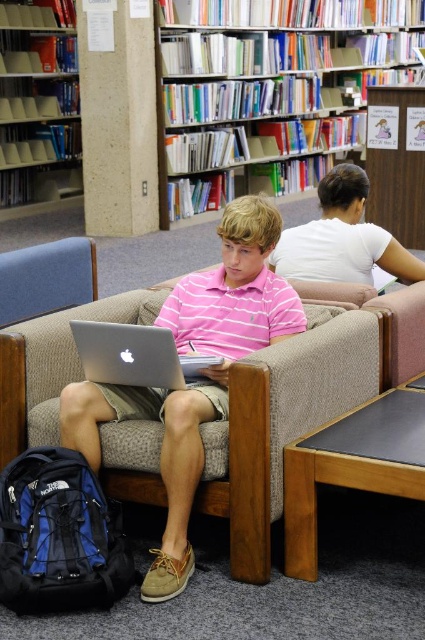
Is white matte shirt at upper right shorter than silver metallic laptop at center?

No, white matte shirt at upper right is not shorter than silver metallic laptop at center.

Between white matte shirt at upper right and silver metallic laptop at center, which one appears on the right side from the viewer's perspective?

white matte shirt at upper right

Where is `white matte shirt at upper right`? white matte shirt at upper right is located at coordinates (342, 237).

Where is `white matte shirt at upper right`? This screenshot has width=425, height=640. white matte shirt at upper right is located at coordinates (342, 237).

Who is positioned more to the left, matte plastic bookshelf at upper left or silver metallic laptop at center?

Positioned to the left is matte plastic bookshelf at upper left.

Is matte plastic bookshelf at upper left above silver metallic laptop at center?

Indeed, matte plastic bookshelf at upper left is positioned over silver metallic laptop at center.

Does point (8, 198) come farther from viewer compared to point (132, 355)?

Yes.

Find the location of `matte plastic bookshelf at upper left`. matte plastic bookshelf at upper left is located at coordinates (39, 102).

Between point (269, 442) and point (277, 268), which one is positioned in front?

Point (269, 442)

In order to click on beige fabric couch at center in this screenshot , I will do `click(283, 420)`.